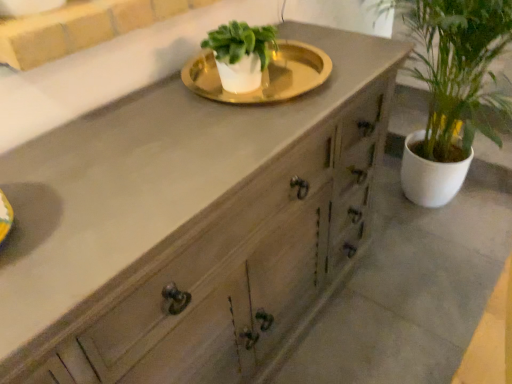
Locate an element on the screen. The width and height of the screenshot is (512, 384). vacant area that lies in front of gold metallic tray at center is located at coordinates (208, 137).